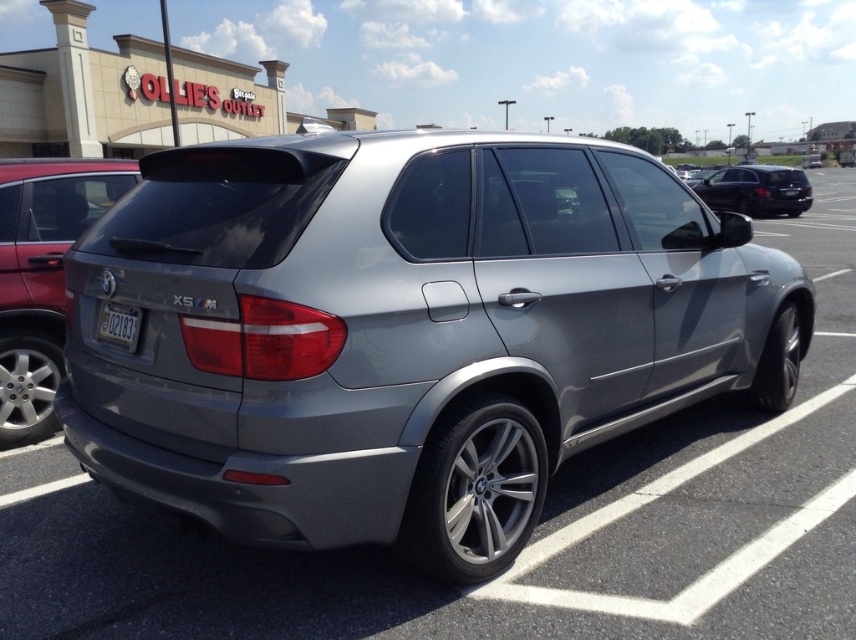
You are a parking attendant who needs to fit both the satin metallic suv at center and the shiny black sedan at right into a compact parking space. Based on their sizes, which vehicle should you park first to ensure both fit?

The satin metallic suv at center occupies less space than the shiny black sedan at right, so you should park the shiny black sedan at right first to accommodate its larger size before fitting the smaller suv.

You are a delivery driver who needs to unload a package from your truck. You see the satin metallic suv at center and the satin silver minivan at rear in the parking lot. Which vehicle is blocking the other from moving forward?

The satin metallic suv at center is positioned under the satin silver minivan at rear, meaning the minivan is blocking the SUV from moving forward.

You are a delivery driver who needs to back out of the parking spot where the satin silver minivan at rear is parked. Can you safely back out without hitting the silver BMW X5 M parked nearby?

The satin silver minivan at rear is positioned at point (42, 276), which is at the rear of the parking spot. Since the silver BMW X5 M is parked at an angle with its rear facing slightly towards the left side of the frame, there should be enough space to safely back out without hitting the BMW.